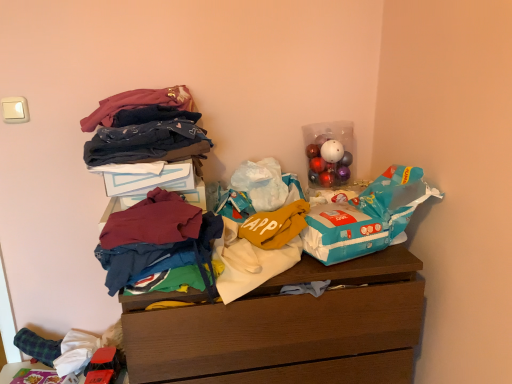
I want to click on empty space that is ontop of blue cotton blanket at upper left, which appears as the third clothing when ordered from the bottom (from a real-world perspective), so click(x=151, y=121).